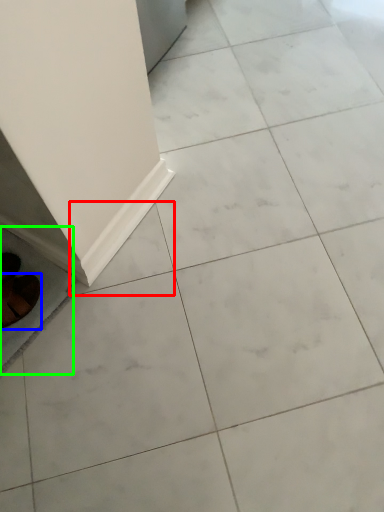
Question: Considering the real-world distances, which object is farthest from ceramic tile (highlighted by a red box)? footwear (highlighted by a blue box) or ceramic tile (highlighted by a green box)?

Choices:
 (A) footwear
 (B) ceramic tile

Answer: (A)